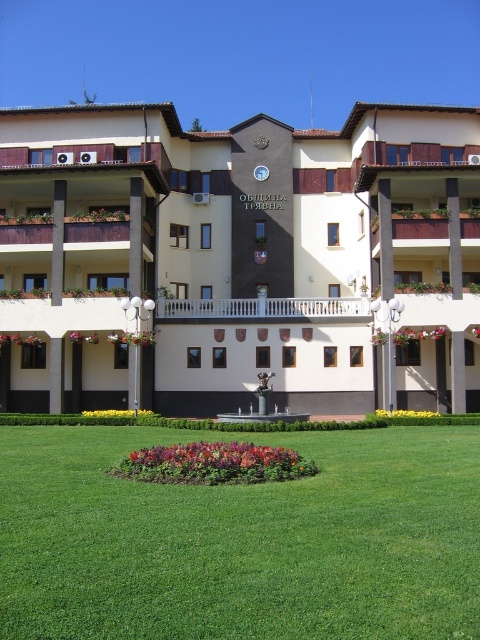
Question: Which of the following is the farthest from the observer?

Choices:
 (A) beige concrete building at center
 (B) green grass at center

Answer: (A)

Question: Which of the following is the closest to the observer?

Choices:
 (A) (476, 496)
 (B) (109, 298)

Answer: (A)

Question: Among these points, which one is farthest from the camera?

Choices:
 (A) (98, 268)
 (B) (441, 515)

Answer: (A)

Question: Is beige concrete building at center positioned before green grass at center?

Choices:
 (A) no
 (B) yes

Answer: (A)

Question: Is beige concrete building at center to the left of green grass at center from the viewer's perspective?

Choices:
 (A) no
 (B) yes

Answer: (B)

Question: Can you confirm if beige concrete building at center is thinner than green grass at center?

Choices:
 (A) yes
 (B) no

Answer: (B)